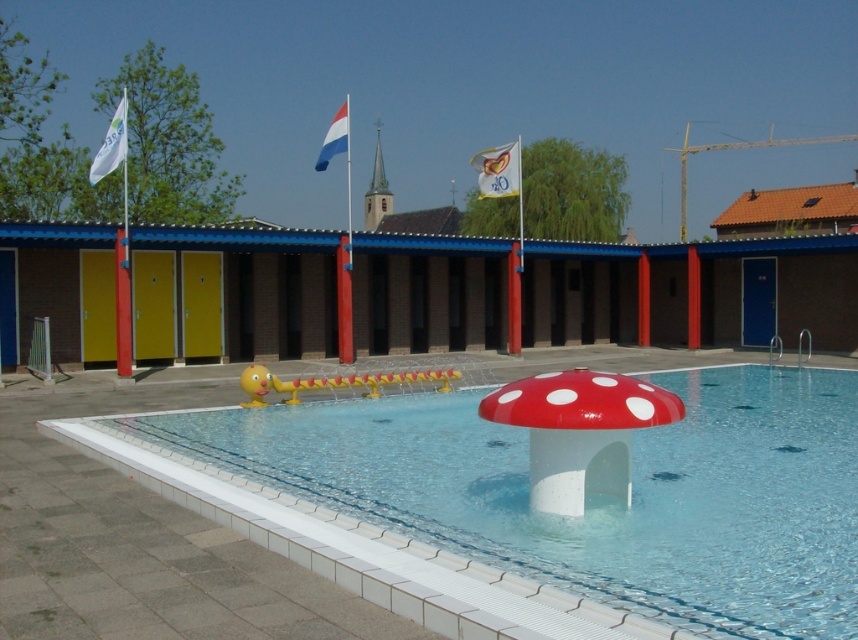
Does white fabric flag at upper left have a smaller size compared to red-white-blue fabric flag at upper center?

Incorrect, white fabric flag at upper left is not smaller in size than red-white-blue fabric flag at upper center.

Between white fabric flag at upper left and red-white-blue fabric flag at upper center, which one appears on the right side from the viewer's perspective?

From the viewer's perspective, red-white-blue fabric flag at upper center appears more on the right side.

The height and width of the screenshot is (640, 858). I want to click on white fabric flag at upper left, so click(112, 145).

Where is `white fabric flag at upper left`? The image size is (858, 640). white fabric flag at upper left is located at coordinates (112, 145).

Which is behind, point (512, 157) or point (322, 168)?

Positioned behind is point (322, 168).

Can you confirm if white fabric flag at upper center is shorter than red-white-blue fabric flag at upper center?

Indeed, white fabric flag at upper center has a lesser height compared to red-white-blue fabric flag at upper center.

Which is in front, point (517, 189) or point (333, 122)?

Positioned in front is point (517, 189).

Find the location of a particular element. This screenshot has width=858, height=640. white fabric flag at upper center is located at coordinates [498, 170].

Does white glossy mushroom at center have a lesser height compared to red-white-blue fabric flag at upper center?

Correct, white glossy mushroom at center is not as tall as red-white-blue fabric flag at upper center.

At what (x,y) coordinates should I click in order to perform the action: click on white glossy mushroom at center. Please return your answer as a coordinate pair (x, y). The image size is (858, 640). Looking at the image, I should click on [533, 515].

This screenshot has height=640, width=858. I want to click on white glossy mushroom at center, so pyautogui.click(x=533, y=515).